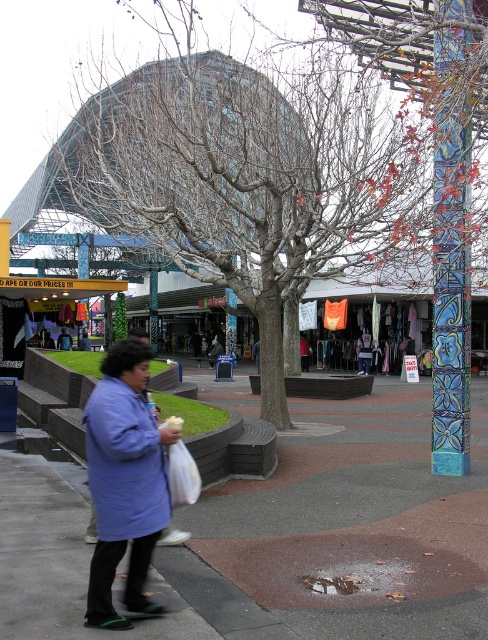
Measure the distance from concrete sidewalk at center to dark blue shirt at center.

concrete sidewalk at center is 21.53 meters from dark blue shirt at center.

Is concrete sidewalk at center to the right of dark blue shirt at center from the viewer's perspective?

Correct, you'll find concrete sidewalk at center to the right of dark blue shirt at center.

Between point (288, 454) and point (58, 348), which one is positioned in front?

Positioned in front is point (288, 454).

Image resolution: width=488 pixels, height=640 pixels. I want to click on concrete sidewalk at center, so click(344, 529).

Is blue fabric coat at lower left wider than dark blue shirt at center?

Indeed, blue fabric coat at lower left has a greater width compared to dark blue shirt at center.

In the scene shown: Who is more forward, (114,406) or (59,339)?

Point (114,406)

Where is `blue fabric coat at lower left`? blue fabric coat at lower left is located at coordinates (124, 481).

Does blue fabric coat at lower left appear on the left side of multicolored mosaic pillar at right?

Indeed, blue fabric coat at lower left is positioned on the left side of multicolored mosaic pillar at right.

Between blue fabric coat at lower left and multicolored mosaic pillar at right, which one has more height?

With more height is multicolored mosaic pillar at right.

Who is more forward, (94, 436) or (459, 401)?

Positioned in front is point (94, 436).

You are a GUI agent. You are given a task and a screenshot of the screen. Output one action in this format:
    pyautogui.click(x=<x>, y=<y>)
    Task: Click on the blue fabric coat at lower left
    This screenshot has height=640, width=488.
    Given the screenshot: What is the action you would take?
    pyautogui.click(x=124, y=481)